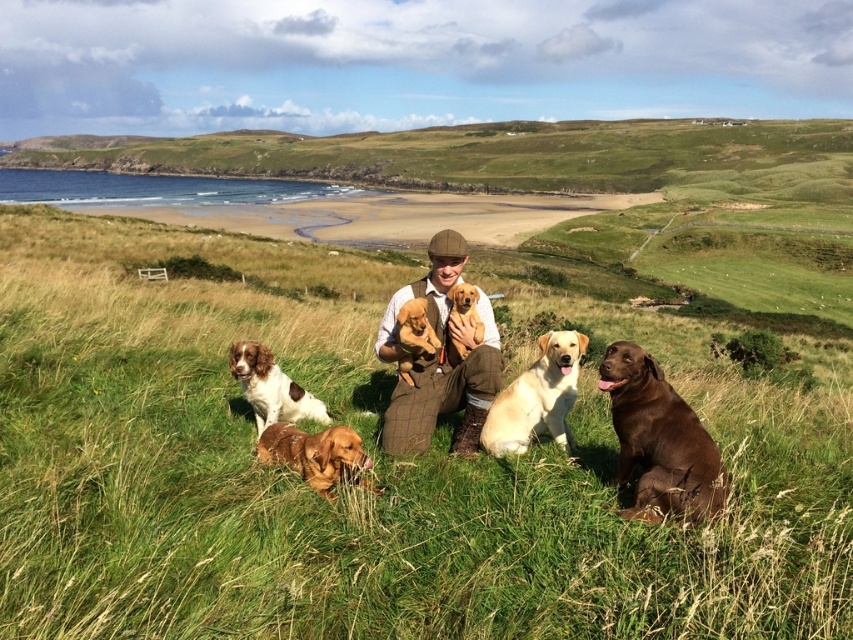
You are a photographer standing 15 centimeters away from the brown tweed suit at center. Can you reach out and touch the golden fur puppies at center without moving your position?

The brown tweed suit at center is 10.31 centimeters away from golden fur puppies at center. Since you are 15 centimeters away from the brown tweed suit at center, you are farther than the distance between them, so you cannot reach the golden fur puppies at center without moving.

You are a photographer standing at the edge of the beach on the left side of the image. You want to take a photo of the brown tweed suit at center and the green grassy hillside at upper center. Which object will appear larger in the photo?

The green grassy hillside at upper center is much taller than the brown tweed suit at center, so it will appear larger in the photo.